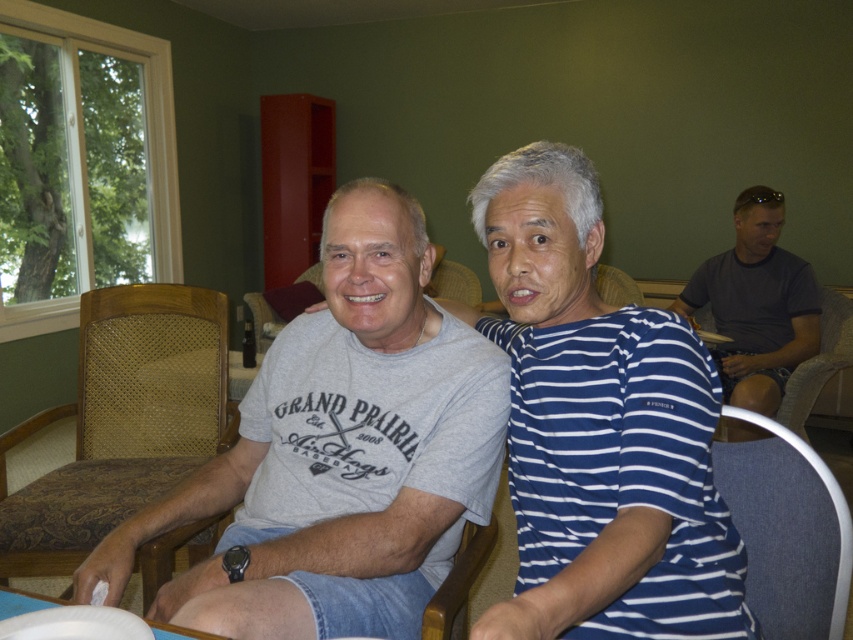
Question: Which point appears farthest from the camera in this image?

Choices:
 (A) (213, 420)
 (B) (782, 264)
 (C) (761, 547)
 (D) (22, 596)

Answer: (B)

Question: Is gray fabric chair at lower right thinner than white paper plate at lower left?

Choices:
 (A) no
 (B) yes

Answer: (B)

Question: Is brown woven wood chair at left to the left of dark gray t-shirt at right from the viewer's perspective?

Choices:
 (A) yes
 (B) no

Answer: (A)

Question: Which of these objects is positioned closest to the white paper plate at lower left?

Choices:
 (A) light brown fabric chair at right
 (B) white plastic plate at lower left
 (C) gray fabric chair at lower right

Answer: (B)

Question: Which object appears closest to the camera in this image?

Choices:
 (A) white paper plate at lower left
 (B) brown woven wood chair at left
 (C) white plastic plate at lower left

Answer: (A)

Question: Is gray cotton t-shirt at center wider than brown woven wood chair at left?

Choices:
 (A) yes
 (B) no

Answer: (A)